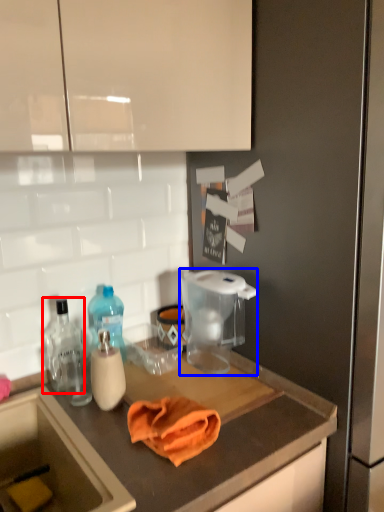
Question: Which object is closer to the camera taking this photo, bottle (highlighted by a red box) or appliance (highlighted by a blue box)?

Choices:
 (A) bottle
 (B) appliance

Answer: (B)